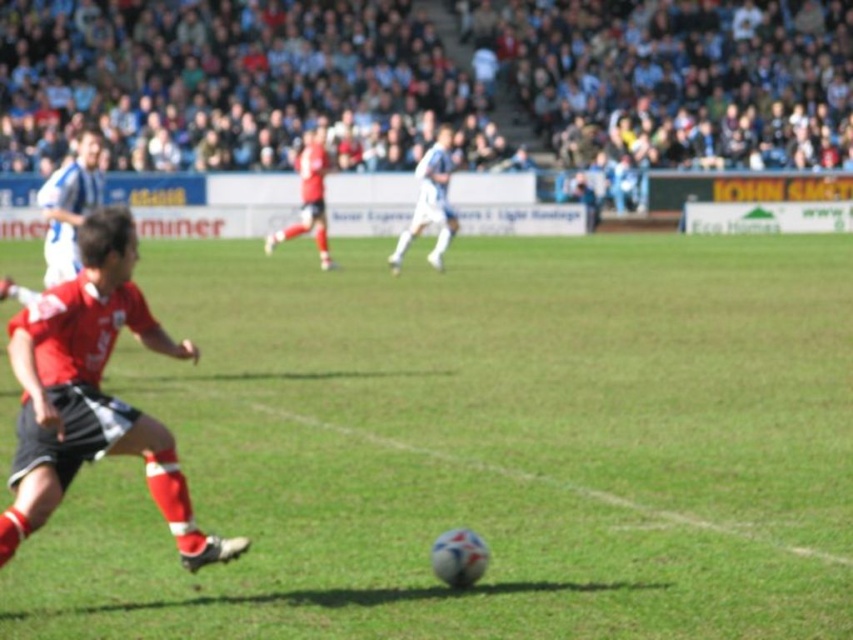
You are a soccer coach analyzing the image. You notice the green grass football field at center and the white matte soccer player at center. Which object is closer to the camera?

The green grass football field at center is closer to the camera because it is in front of the white matte soccer player at center.

You are a drone operator trying to capture aerial footage of the soccer match. You need to ensure the green grass football field at center and the white matte soccer player at center are both clearly visible in your shot. Based on their heights, which object should you focus on to ensure both are in focus?

The green grass football field at center has a lesser height compared to the white matte soccer player at center. To ensure both are in focus, you should focus on the taller object, which is the white matte soccer player at center, as depth of field typically extends more behind the point of focus. This way, the shorter field will still be within the range of acceptable sharpness.